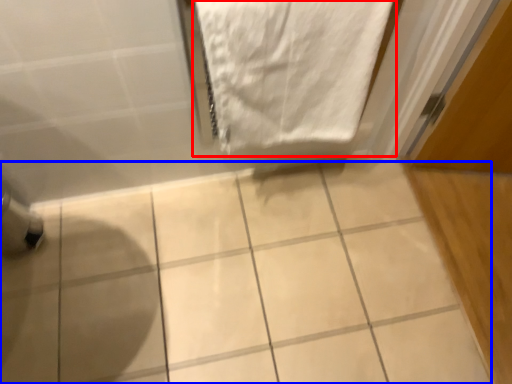
Question: Which of the following is the farthest to the observer, towel (highlighted by a red box) or ceramic tile (highlighted by a blue box)?

Choices:
 (A) towel
 (B) ceramic tile

Answer: (B)